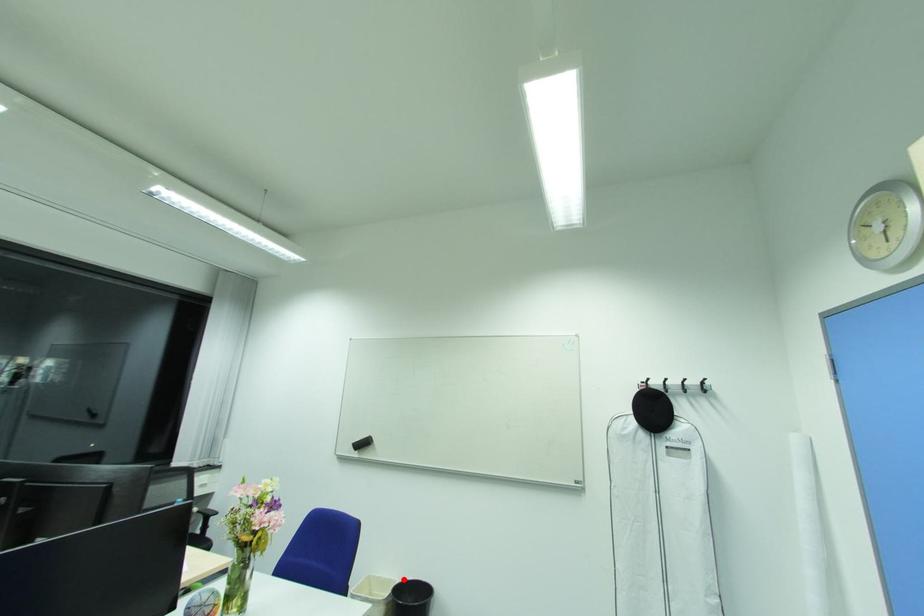
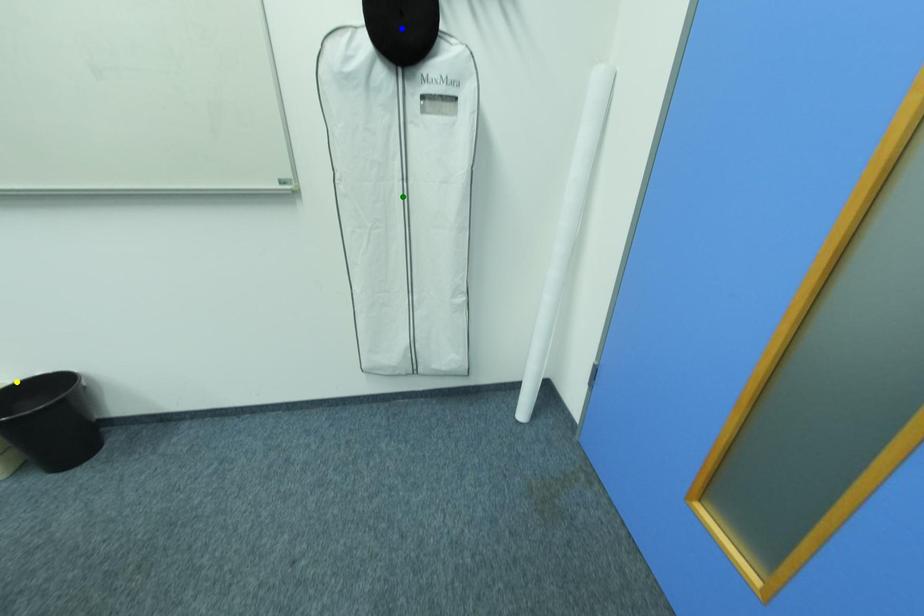
Question: I am providing you with two images of the same scene from different viewpoints. A red point is marked on the first image. You are given multiple points on the second image. In image 2, which mark is for the same physical point as the one in image 1?

Choices:
 (A) yellow point
 (B) green point
 (C) blue point

Answer: (A)